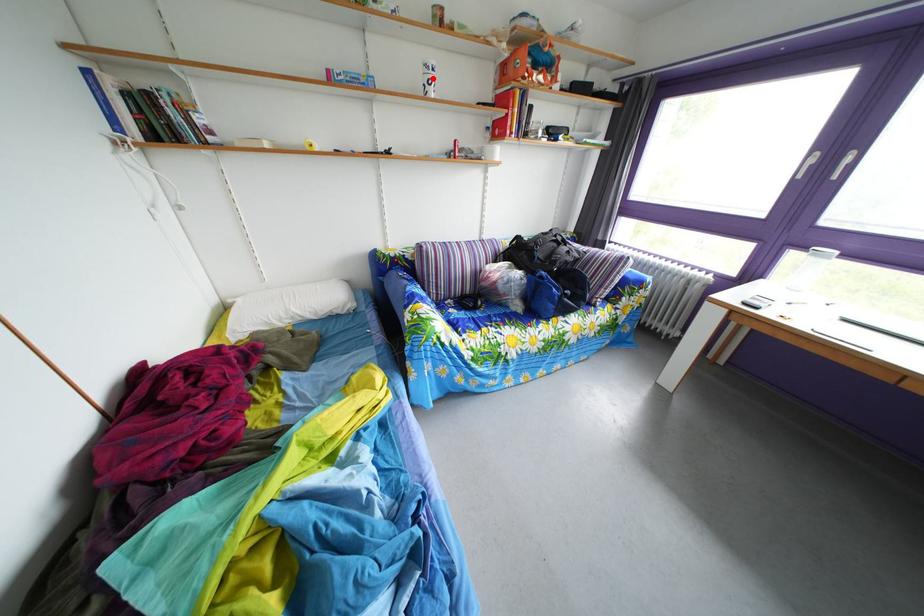
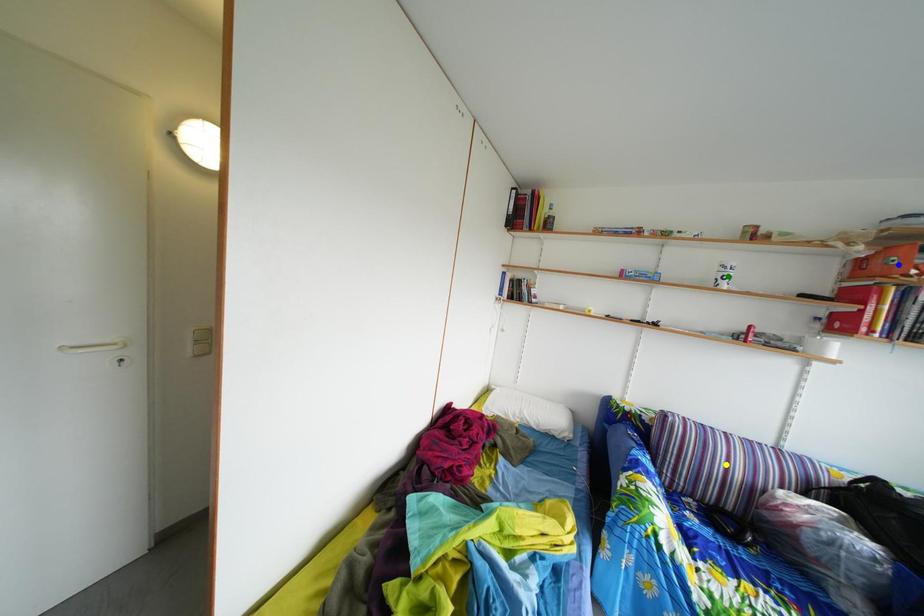
Question: I am providing you with two images of the same scene from different viewpoints. A red point is marked on the first image. You are given multiple points on the second image. Can you choose the point in image 2 that corresponds to the point in image 1?

Choices:
 (A) green point
 (B) yellow point
 (C) blue point

Answer: (A)